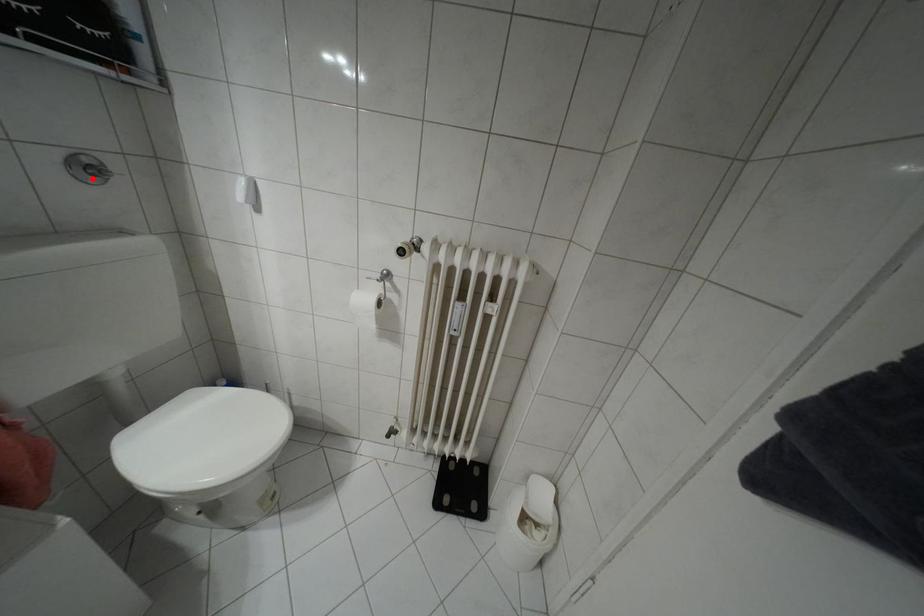
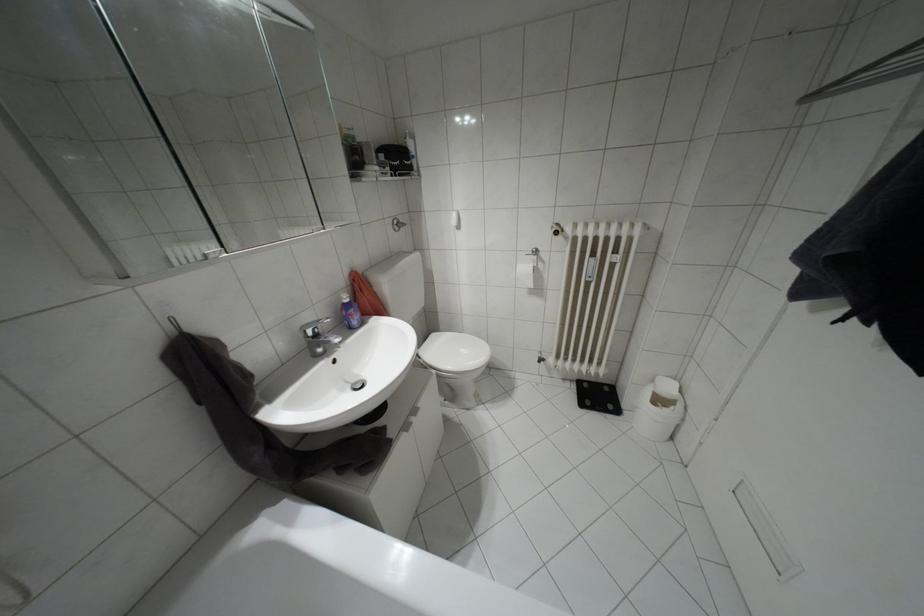
Question: I am providing you with two images of the same scene from different viewpoints. A red point is shown in image1. For the corresponding object point in image2, is it positioned nearer or farther from the camera?

Choices:
 (A) Nearer
 (B) Farther

Answer: (A)